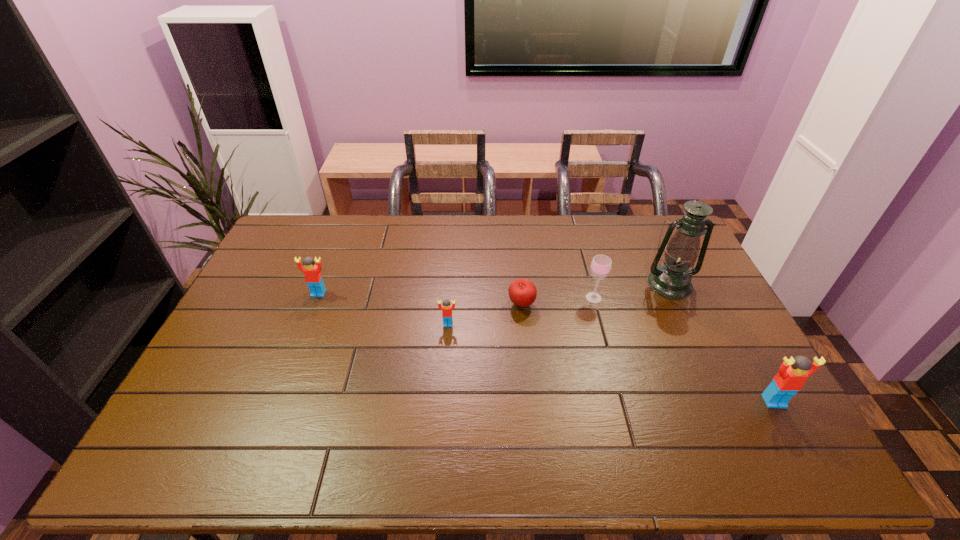
If we want them evenly spaced by inserting an extra Lego among them, please locate a free spot for this new Lego. Please provide its 2D coordinates. Your answer should be formatted as a tuple, i.e. [(x, y)], where the tuple contains the x and y coordinates of a point satisfying the conditions above.

[(598, 360)]